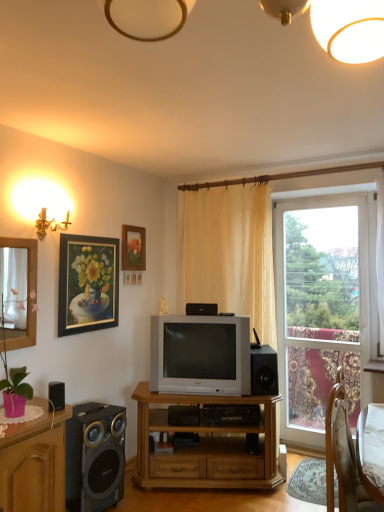
The height and width of the screenshot is (512, 384). In order to click on free space above wooden cabinet at lower left (from a real-world perspective) in this screenshot , I will do `click(27, 413)`.